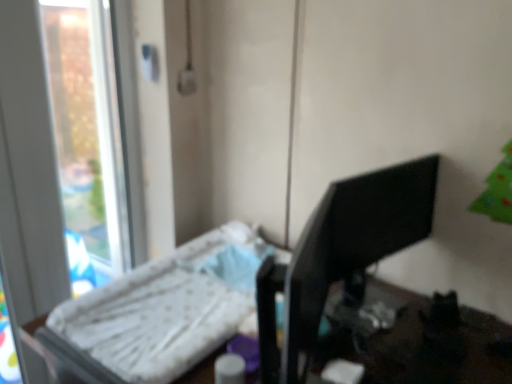
Where is `free spot above white fabric changing table at left (from a real-world perspective)`? The height and width of the screenshot is (384, 512). free spot above white fabric changing table at left (from a real-world perspective) is located at coordinates (257, 332).